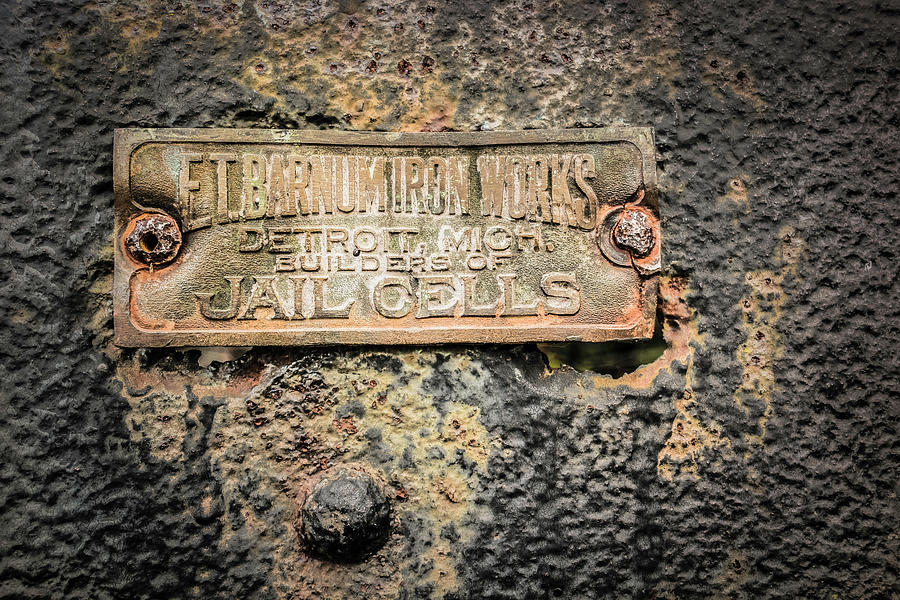
This screenshot has width=900, height=600. I want to click on corners, so click(x=115, y=138), click(x=126, y=335), click(x=648, y=337), click(x=650, y=136).